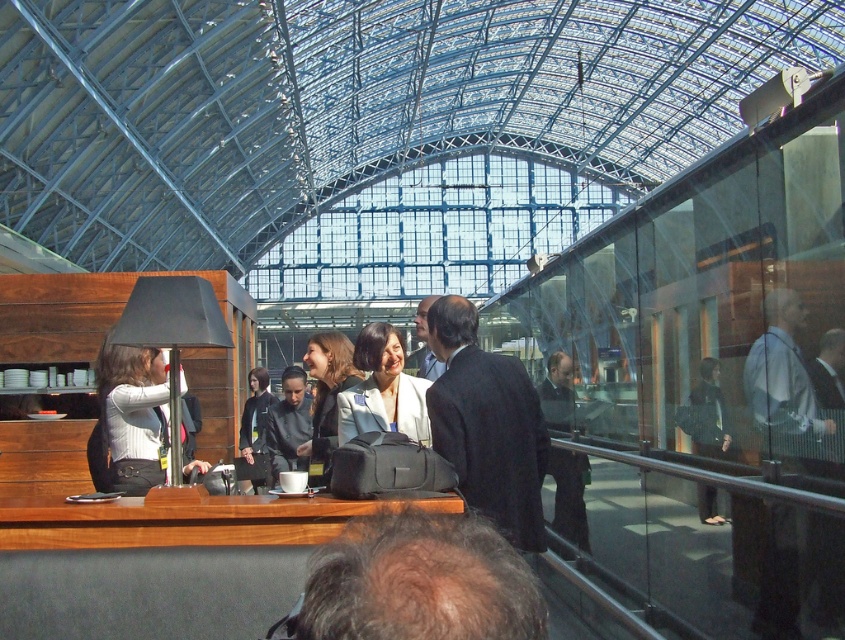
You are a customer entering the building and see the matte black jacket at left and the dark blue suit at center. Which clothing item is positioned closer to the entrance?

The matte black jacket at left is positioned closer to the entrance because it is located to the left of the dark blue suit at center.

You are a customer standing at the counter in the image. You see a light blue shirt at right and a dark suit at right. Which one is higher up in the scene?

The light blue shirt at right is located above the dark suit at right, so it is higher up in the scene.

You are standing at the entrance of the building and see two points marked on the glass roof structure. The first point is at coordinate point(x=811, y=390) and the second point is at coordinate point(x=570, y=456). Which point is closer to your current position?

Point(x=811, y=390) is closer to the camera than point(x=570, y=456), so the first point is closer to your current position.